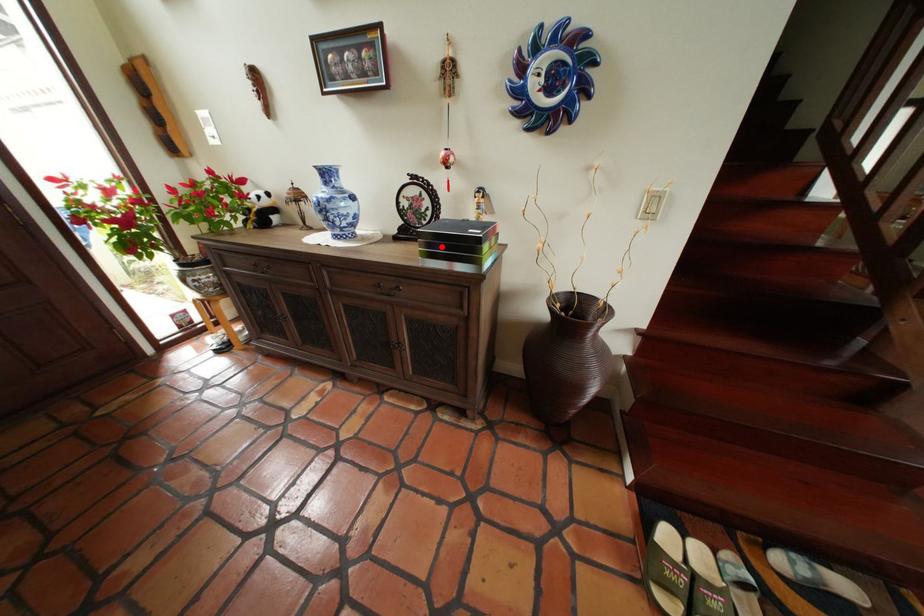
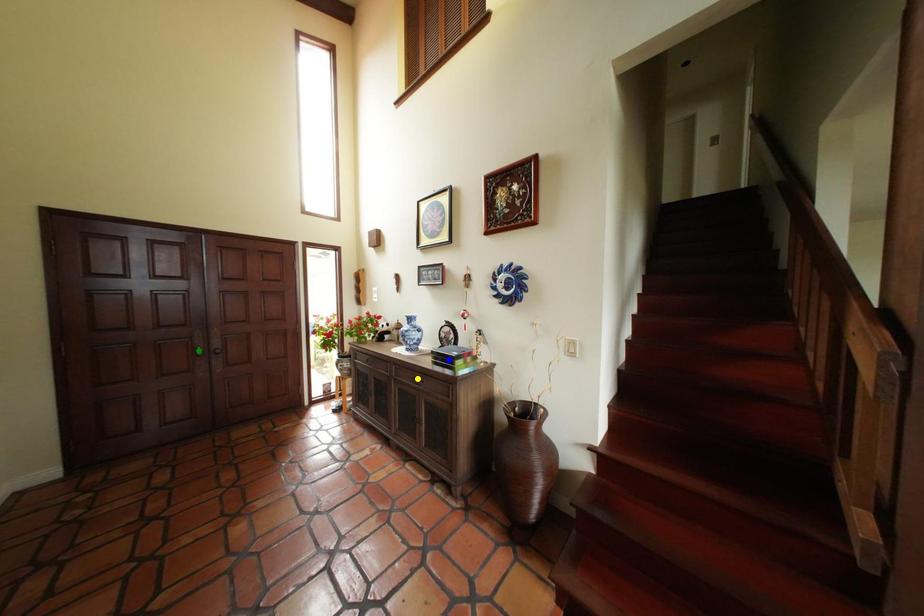
Question: I am providing you with two images of the same scene from different viewpoints. A red point is marked on the first image. You are given multiple points on the second image. Can you choose the point in image 2 that corresponds to the point in image 1?

Choices:
 (A) blue point
 (B) green point
 (C) yellow point

Answer: (A)